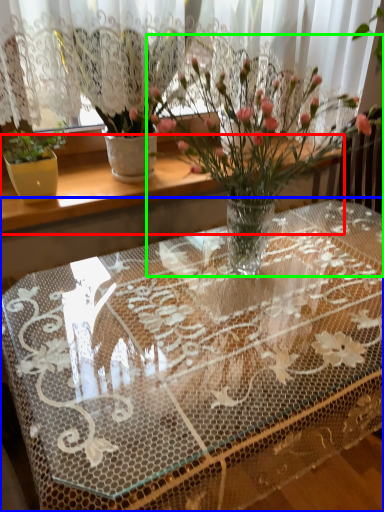
Question: Estimate the real-world distances between objects in this image. Which object is farther from window sill (highlighted by a red box), table (highlighted by a blue box) or houseplant (highlighted by a green box)?

Choices:
 (A) table
 (B) houseplant

Answer: (A)